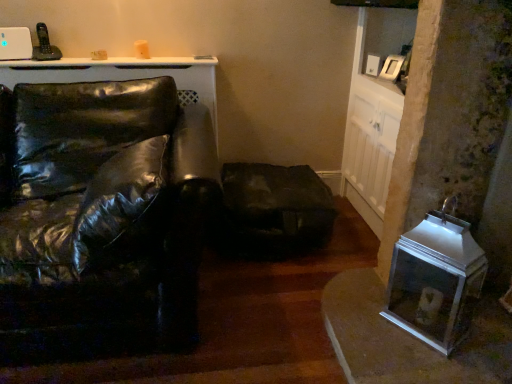
Image resolution: width=512 pixels, height=384 pixels. I want to click on vacant space in front of dark brown leather swivel chair at center, so click(x=269, y=299).